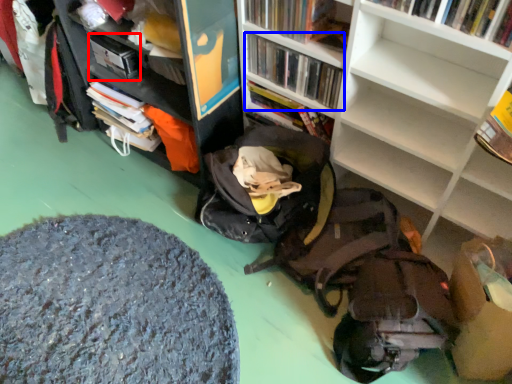
Question: Which point is closer to the camera, paperback book (highlighted by a red box) or book (highlighted by a blue box)?

Choices:
 (A) paperback book
 (B) book

Answer: (B)